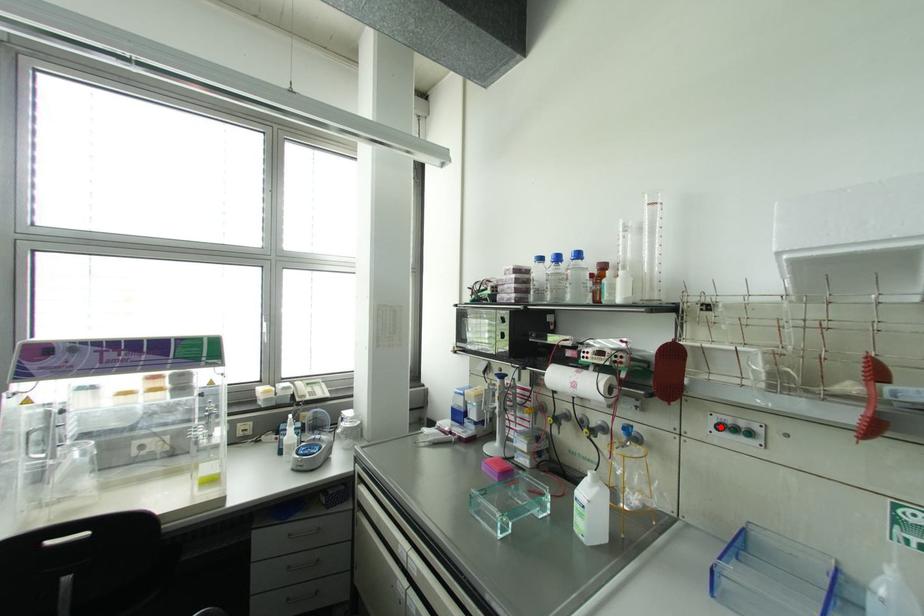
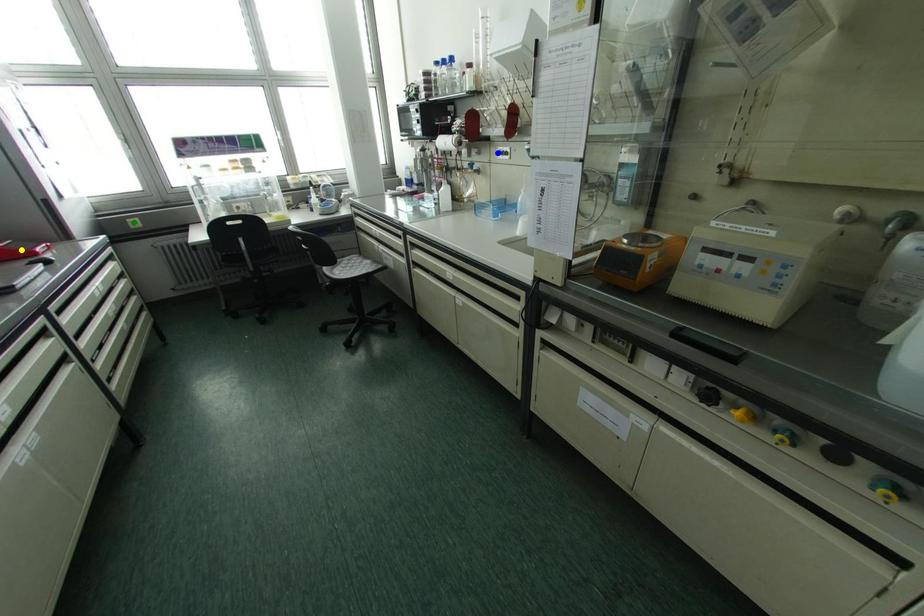
Question: I am providing you with two images of the same scene from different viewpoints. A red point is marked on the first image. You are given multiple points on the second image. Which mark in image 2 goes with the point in image 1?

Choices:
 (A) green point
 (B) blue point
 (C) yellow point

Answer: (B)